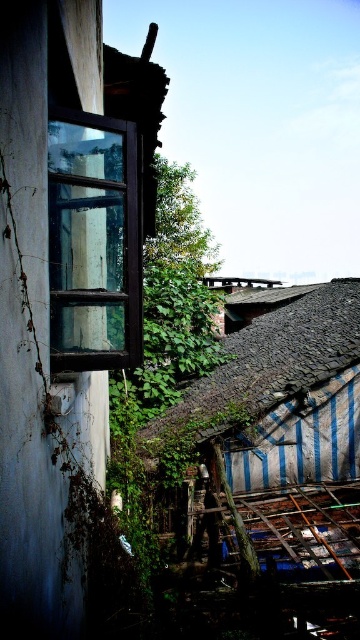
You are standing in front of the old building and want to enter through the dark brown wooden window at left. However, there is a rusty corrugated metal roof at center blocking your path. Can you walk around the roof to reach the window?

The dark brown wooden window at left is to the left of the rusty corrugated metal roof at center, so you can walk around the roof on its left side to reach the window.

You are standing in front of an old building and notice the wooden window frame at left. Can you determine its exact position relative to the center of the image?

The wooden window frame at left is located at point (64, 284), which means it is positioned to the left and slightly below the center of the image.